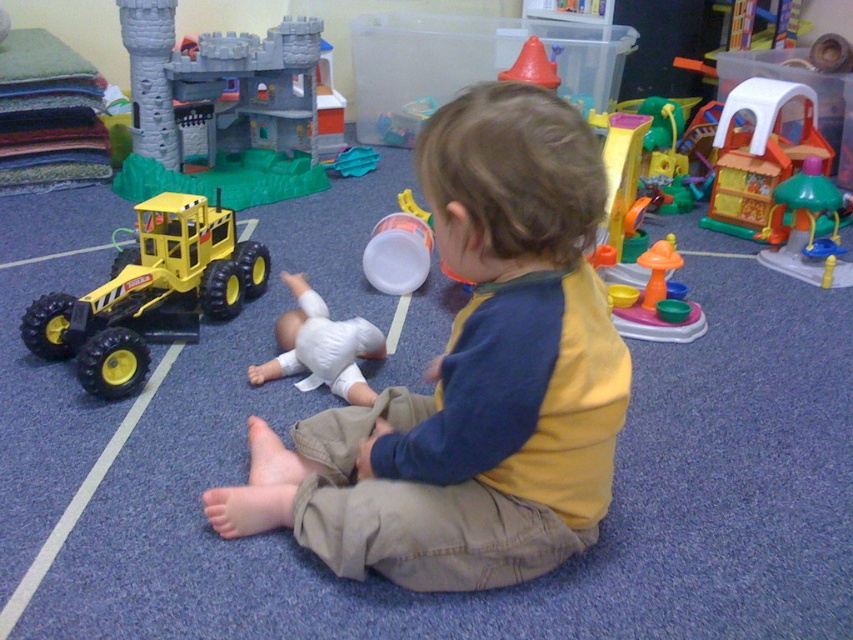
Consider the image. The child is looking at the white matte baby doll at center and the green plastic playhouse at right. Which object is closer to the child?

The white matte baby doll at center is closer to the child because it is positioned closer to the viewer compared to the green plastic playhouse at right.

You are a child who wants to pick up the white matte baby doll at center and the green plastic playhouse at right. Which object will you need to move first to access the other?

The white matte baby doll at center is positioned under the green plastic playhouse at right, so you need to move the green plastic playhouse at right first to access the baby doll.